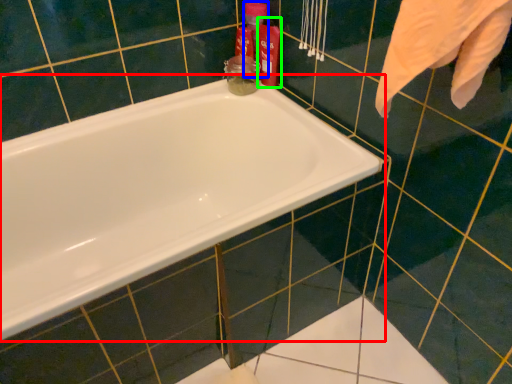
Question: Estimate the real-world distances between objects in this image. Which object is closer to bathtub (highlighted by a red box), cleaning product (highlighted by a blue box) or cleaning product (highlighted by a green box)?

Choices:
 (A) cleaning product
 (B) cleaning product

Answer: (B)